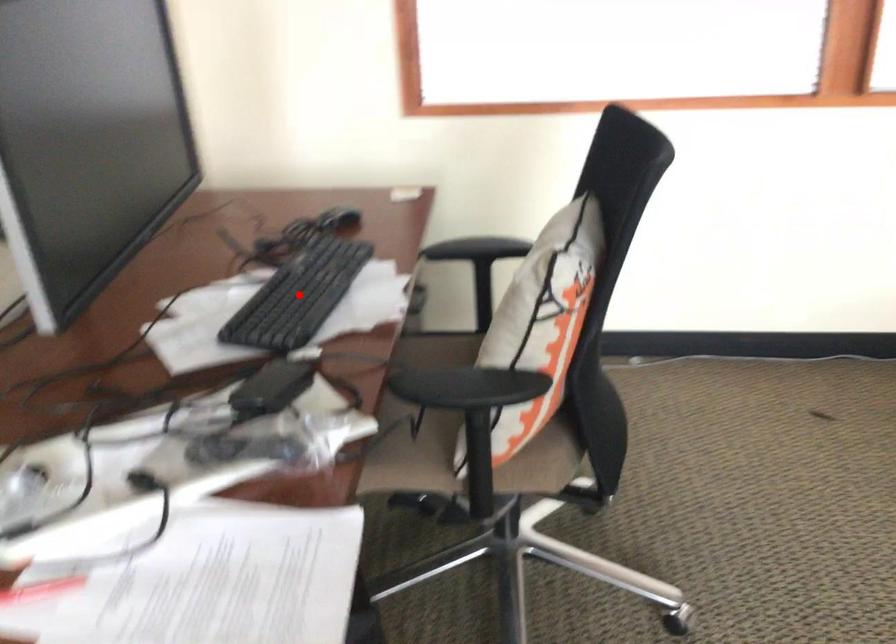
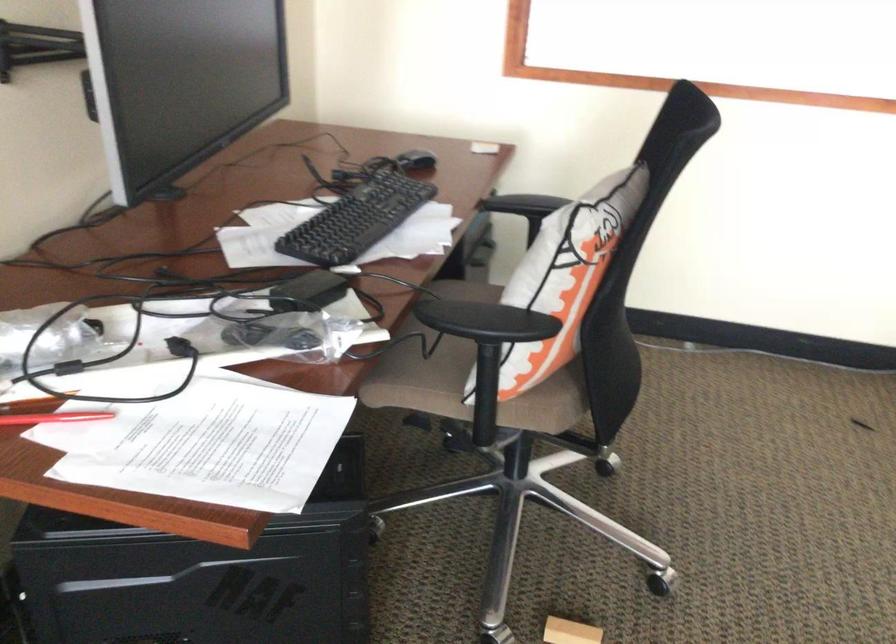
Question: A red point is marked in image1. In image2, is the corresponding 3D point closer to the camera or farther? Reply with the corresponding letter.

Choices:
 (A) The corresponding 3D point is closer.
 (B) The corresponding 3D point is farther.

Answer: (B)